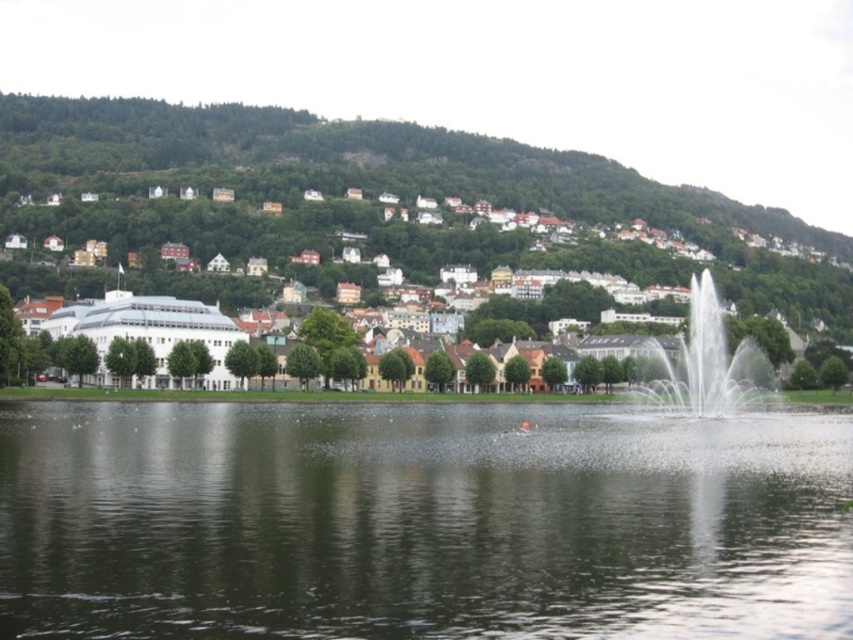
You are standing at the point closest to the fountain in the lake. Which of the two points, point (x=463, y=227) or point (x=741, y=346), is farther away from you?

Point (x=463, y=227) is behind point (x=741, y=346). Since you are standing at the point closest to the fountain, which is likely near the center of the lake, point (x=741, y=346) is closer to you, making point (x=463, y=227) the farther one.

From the picture: You are a photographer planning to capture the fountain in the lake. You have a camera with a wide angle lens that can capture a wide area. You want to ensure that both the clear water at center and the white matte building at center are visible in your shot. Based on their sizes, which object should you focus on to include both in the frame?

The clear water at center is thinner than the white matte building at center, so you should focus on the white matte building at center since it is wider and will help frame both objects effectively.